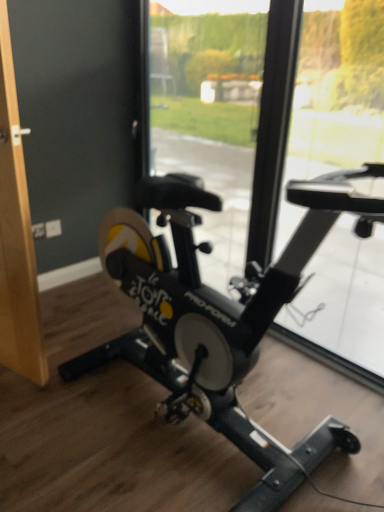
Question: Does black matte stationary bicycle at center contain transparent glass window at center, the 1th window screen positioned from the left?

Choices:
 (A) yes
 (B) no

Answer: (B)

Question: From a real-world perspective, is black matte stationary bicycle at center under transparent glass window at center, the 1th window screen positioned from the left?

Choices:
 (A) yes
 (B) no

Answer: (A)

Question: Does black matte stationary bicycle at center have a larger size compared to transparent glass window at center, which appears as the second window screen when viewed from the right?

Choices:
 (A) no
 (B) yes

Answer: (B)

Question: From the image's perspective, would you say black matte stationary bicycle at center is shown under transparent glass window at center, which appears as the second window screen when viewed from the right?

Choices:
 (A) yes
 (B) no

Answer: (A)

Question: Does black matte stationary bicycle at center have a lesser width compared to transparent glass window at center, the 1th window screen positioned from the left?

Choices:
 (A) yes
 (B) no

Answer: (B)

Question: Looking at their shapes, would you say wooden door handle at left is wider or thinner than transparent glass window at center, arranged as the 1th window screen when viewed from the right?

Choices:
 (A) thin
 (B) wide

Answer: (B)

Question: From the image's perspective, is wooden door handle at left above or below transparent glass window at center, acting as the 2th window screen starting from the left?

Choices:
 (A) below
 (B) above

Answer: (A)

Question: From a real-world perspective, is wooden door handle at left positioned above or below transparent glass window at center, arranged as the 1th window screen when viewed from the right?

Choices:
 (A) below
 (B) above

Answer: (A)

Question: Is wooden door handle at left spatially inside transparent glass window at center, acting as the 2th window screen starting from the left, or outside of it?

Choices:
 (A) outside
 (B) inside

Answer: (A)

Question: In terms of width, does wooden door handle at left look wider or thinner when compared to black matte stationary bicycle at center?

Choices:
 (A) thin
 (B) wide

Answer: (A)

Question: Do you think wooden door handle at left is within black matte stationary bicycle at center, or outside of it?

Choices:
 (A) outside
 (B) inside

Answer: (A)

Question: Is wooden door handle at left to the left or to the right of black matte stationary bicycle at center in the image?

Choices:
 (A) left
 (B) right

Answer: (A)

Question: Is point (16, 262) closer or farther from the camera than point (276, 293)?

Choices:
 (A) farther
 (B) closer

Answer: (A)

Question: Visually, is transparent glass window at center, arranged as the 1th window screen when viewed from the right, positioned to the left or to the right of wooden door handle at left?

Choices:
 (A) right
 (B) left

Answer: (A)

Question: Based on their sizes in the image, would you say transparent glass window at center, arranged as the 1th window screen when viewed from the right, is bigger or smaller than wooden door handle at left?

Choices:
 (A) small
 (B) big

Answer: (A)